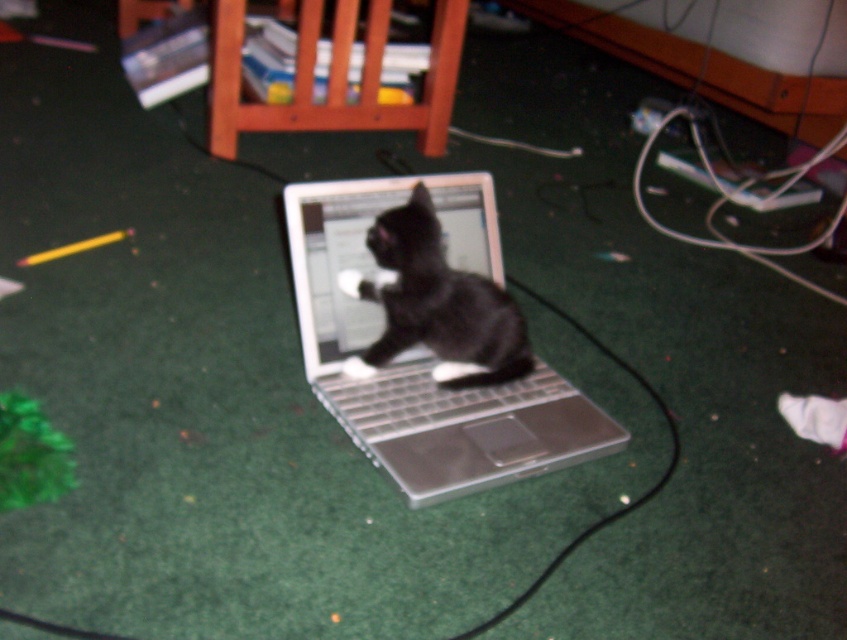
You are trying to place a small toy mouse between the silver metallic laptop at center and the black matte fur cat at center. Can you fit it there based on their heights?

The silver metallic laptop at center is taller than the black matte fur cat at center, so the toy mouse could be placed between them as there is vertical space available.

You are trying to type on the silver metallic keyboard at center but notice the black matte fur cat at center is in the way. Which direction should you move the cat to so you can access the keyboard?

The black matte fur cat at center is to the left of the silver metallic keyboard at center, so you should move the cat to the right to access the keyboard.

You are trying to type on the silver metallic keyboard at center but notice the silver metallic laptop at center is blocking it. Can you still type on the keyboard?

The silver metallic laptop at center is in front of the silver metallic keyboard at center, so it is blocking access to the keyboard. You cannot type on the keyboard while the laptop is in this position.